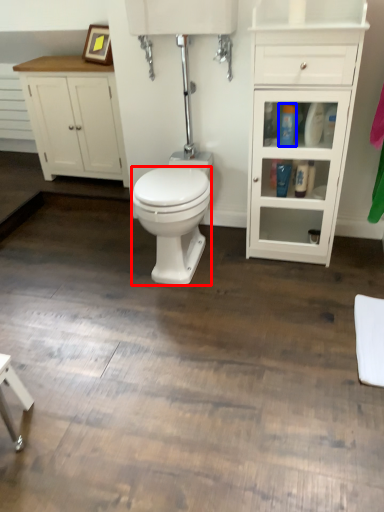
Question: Which object appears farthest to the camera in this image, bidet (highlighted by a red box) or toiletry (highlighted by a blue box)?

Choices:
 (A) bidet
 (B) toiletry

Answer: (B)